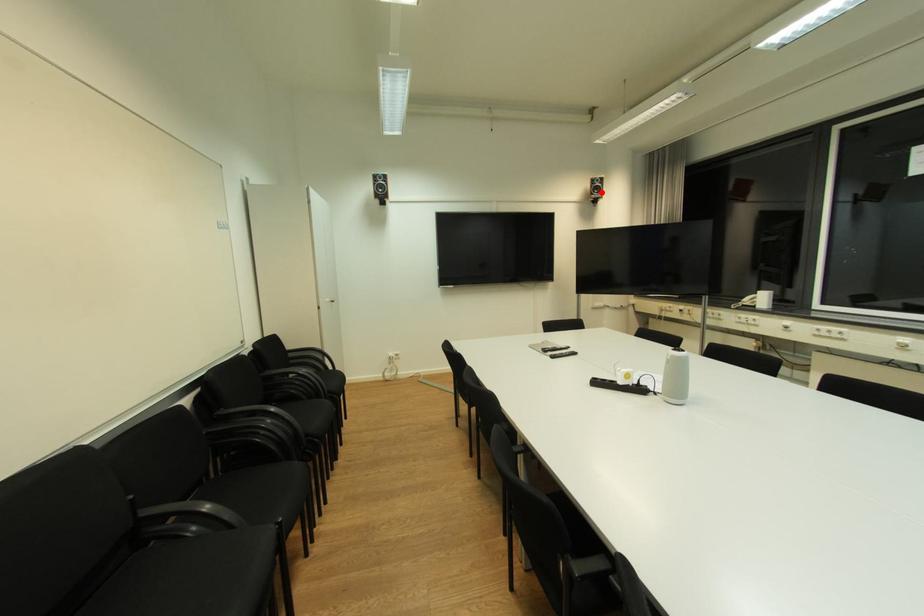
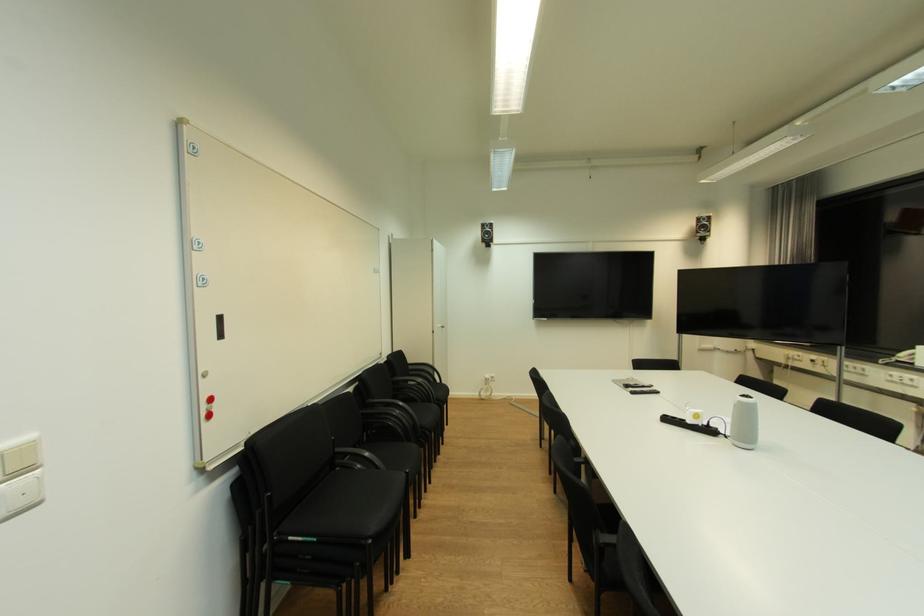
The point at the highlighted location is marked in the first image. Where is the corresponding point in the second image?

(708, 231)